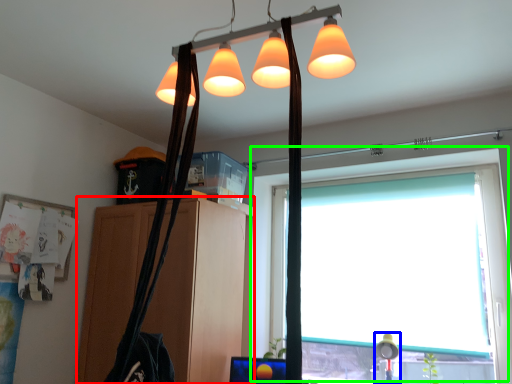
Question: Based on their relative distances, which object is farther from cabinetry (highlighted by a red box)? Choose from table lamp (highlighted by a blue box) and window (highlighted by a green box).

Choices:
 (A) table lamp
 (B) window

Answer: (A)